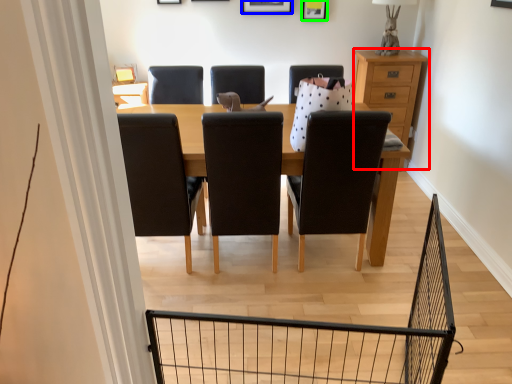
Question: Which is nearer to the chest of drawers (highlighted by a red box)? picture frame (highlighted by a blue box) or picture frame (highlighted by a green box).

Choices:
 (A) picture frame
 (B) picture frame

Answer: (B)